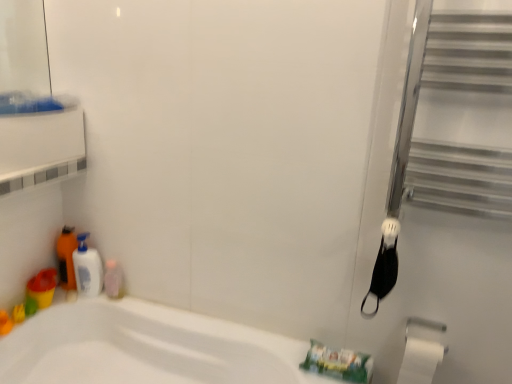
Question: From the image's perspective, is translucent plastic bottle at lower left, placed as the 2th toiletry when sorted from right to left, below silver metallic towel bar at lower right?

Choices:
 (A) yes
 (B) no

Answer: (B)

Question: Is translucent plastic bottle at lower left, placed as the 2th toiletry when sorted from right to left, at the left side of silver metallic towel bar at lower right?

Choices:
 (A) no
 (B) yes

Answer: (B)

Question: Can we say translucent plastic bottle at lower left, placed as the 2th toiletry when sorted from right to left, lies outside silver metallic towel bar at lower right?

Choices:
 (A) no
 (B) yes

Answer: (B)

Question: Are translucent plastic bottle at lower left, marked as the first toiletry in a left-to-right arrangement, and silver metallic towel bar at lower right making contact?

Choices:
 (A) yes
 (B) no

Answer: (B)

Question: Is translucent plastic bottle at lower left, placed as the 2th toiletry when sorted from right to left, aimed at silver metallic towel bar at lower right?

Choices:
 (A) yes
 (B) no

Answer: (A)

Question: Which is correct: silver metallic towel bar at lower right is inside translucent plastic cup at lower left, or outside of it?

Choices:
 (A) outside
 (B) inside

Answer: (A)

Question: Looking at their shapes, would you say silver metallic towel bar at lower right is wider or thinner than translucent plastic cup at lower left?

Choices:
 (A) thin
 (B) wide

Answer: (A)

Question: From their relative heights in the image, would you say silver metallic towel bar at lower right is taller or shorter than translucent plastic cup at lower left?

Choices:
 (A) tall
 (B) short

Answer: (B)

Question: From the image's perspective, relative to translucent plastic cup at lower left, is silver metallic towel bar at lower right above or below?

Choices:
 (A) below
 (B) above

Answer: (A)

Question: Would you say translucent plastic bottle at lower left, marked as the first toiletry in a left-to-right arrangement, is inside or outside pink glossy bottle at lower left, which ranks as the 1th toiletry in right-to-left order?

Choices:
 (A) outside
 (B) inside

Answer: (A)

Question: From their relative heights in the image, would you say translucent plastic bottle at lower left, placed as the 2th toiletry when sorted from right to left, is taller or shorter than pink glossy bottle at lower left, which ranks as the 2th toiletry in left-to-right order?

Choices:
 (A) short
 (B) tall

Answer: (B)

Question: Considering the positions of point (66, 246) and point (111, 261), is point (66, 246) closer or farther from the camera than point (111, 261)?

Choices:
 (A) farther
 (B) closer

Answer: (B)

Question: From the image's perspective, relative to pink glossy bottle at lower left, which ranks as the 2th toiletry in left-to-right order, is translucent plastic bottle at lower left, marked as the first toiletry in a left-to-right arrangement, above or below?

Choices:
 (A) below
 (B) above

Answer: (B)

Question: In terms of size, does black matte screen door at right appear bigger or smaller than translucent plastic bottle at lower left, marked as the first toiletry in a left-to-right arrangement?

Choices:
 (A) small
 (B) big

Answer: (B)

Question: Is black matte screen door at right to the left or to the right of translucent plastic bottle at lower left, marked as the first toiletry in a left-to-right arrangement, in the image?

Choices:
 (A) right
 (B) left

Answer: (A)